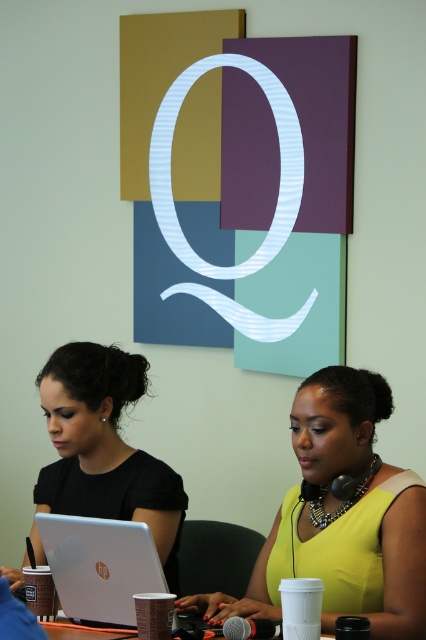
Question: Does yellow matte dress at center lie in front of black matte laptop at left?

Choices:
 (A) no
 (B) yes

Answer: (B)

Question: Does white matte laptop at center lie behind white glossy table at lower center?

Choices:
 (A) yes
 (B) no

Answer: (A)

Question: Is black matte laptop at left above white glossy table at lower center?

Choices:
 (A) yes
 (B) no

Answer: (A)

Question: Which point appears closest to the camera in this image?

Choices:
 (A) (131, 632)
 (B) (362, 573)

Answer: (A)

Question: Which object is closer to the camera taking this photo?

Choices:
 (A) white matte laptop at center
 (B) white glossy table at lower center
 (C) yellow matte dress at center

Answer: (C)

Question: Which point appears closest to the camera in this image?

Choices:
 (A) (368, 381)
 (B) (51, 621)

Answer: (B)